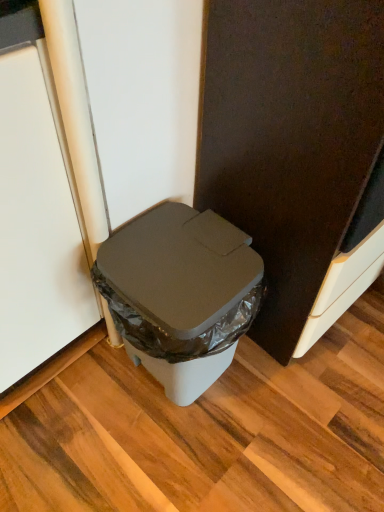
You are a GUI agent. You are given a task and a screenshot of the screen. Output one action in this format:
    pyautogui.click(x=<x>, y=<y>)
    Task: Click on the empty space that is ontop of matte plastic trash can at center
    
    Given the screenshot: What is the action you would take?
    pyautogui.click(x=177, y=259)